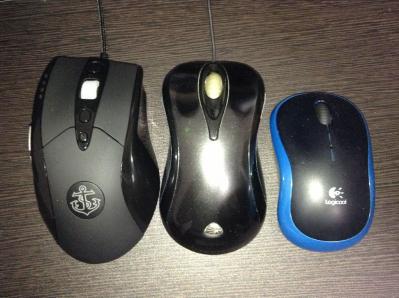
Locate an element on the screen. The width and height of the screenshot is (399, 298). computer mice is located at coordinates (110, 157), (207, 166), (313, 180).